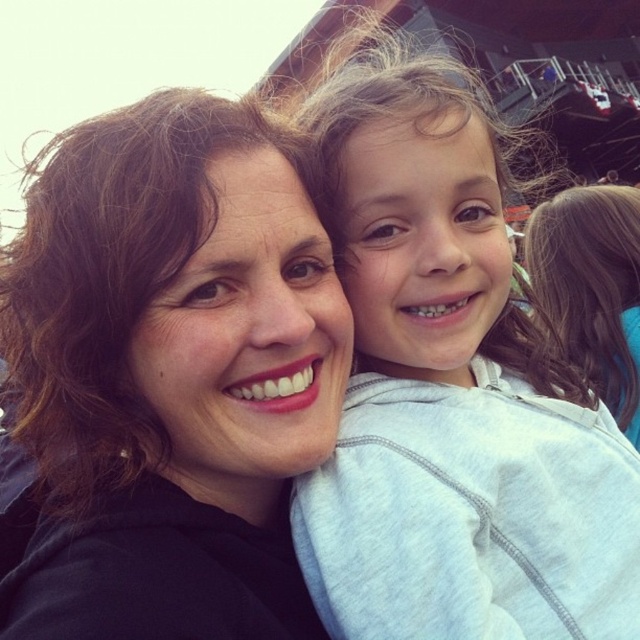
Question: Among these objects, which one is farthest from the camera?

Choices:
 (A) gray cotton hoodie at upper right
 (B) matte black hoodie at center

Answer: (A)

Question: Is matte black hoodie at center positioned at the back of gray cotton hoodie at upper right?

Choices:
 (A) yes
 (B) no

Answer: (B)

Question: Is matte black hoodie at center thinner than gray cotton hoodie at upper right?

Choices:
 (A) yes
 (B) no

Answer: (A)

Question: Can you confirm if matte black hoodie at center is smaller than gray cotton hoodie at upper right?

Choices:
 (A) yes
 (B) no

Answer: (A)